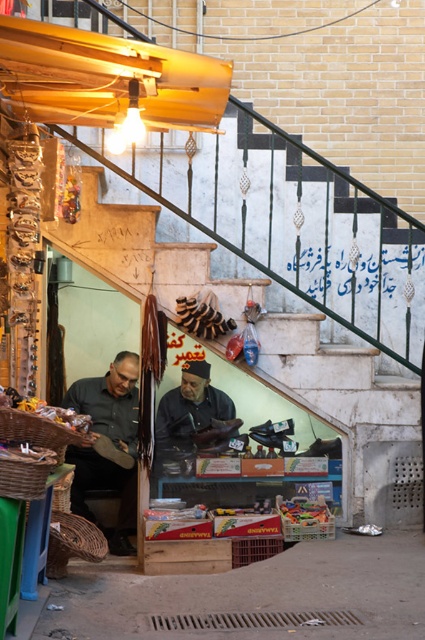
You are a customer entering the shop and want to see both the dark brown leather cap at center and the metallic silver sign at center. Which object will you see first when you first enter the shop?

The metallic silver sign at center is above the dark brown leather cap at center, so you will see the metallic silver sign at center first when entering the shop.

What is located at the coordinates point (113, 442) in the image?

The point (113, 442) marks the location of the dark gray shirt at center.

You are standing outside the shop looking through the glass window. You notice a dark gray shirt at center and a metallic silver sign at center inside the shop. Which object is closer to you through the window?

The dark gray shirt at center is closer to the viewer than the metallic silver sign at center.